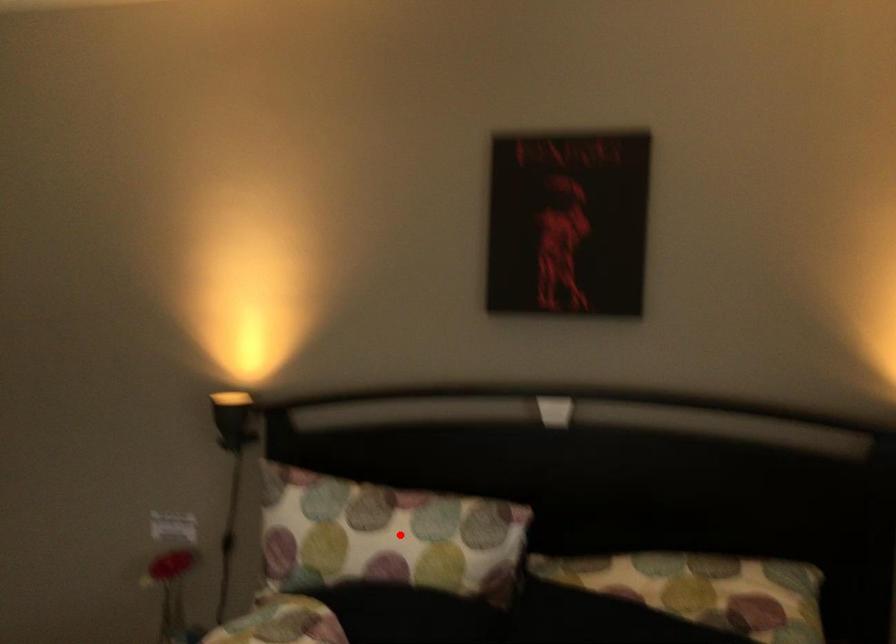
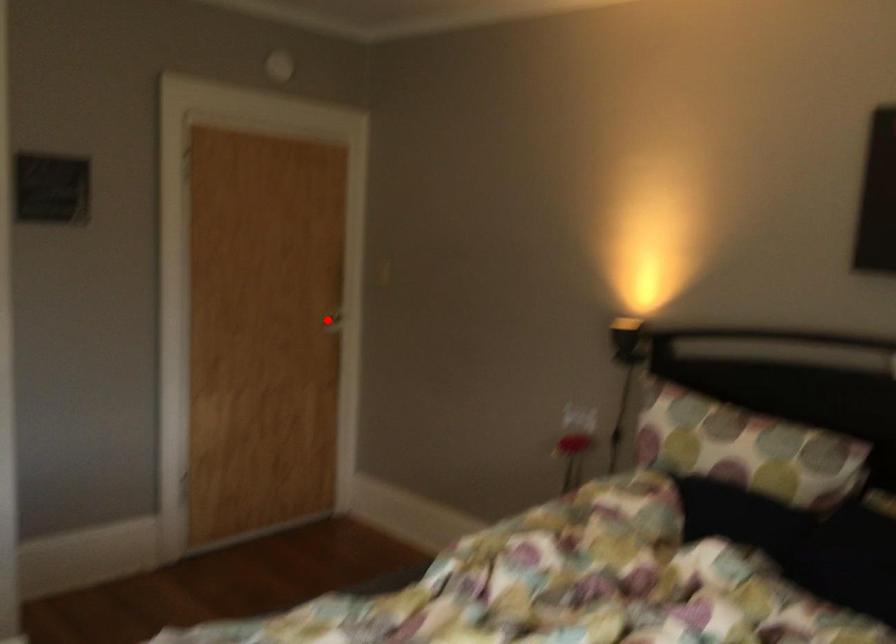
I am providing you with two images of the same scene from different viewpoints. A red point is marked on the first image and another point is marked on the second image. Are the points marked in image1 and image2 representing the same 3D position?

No